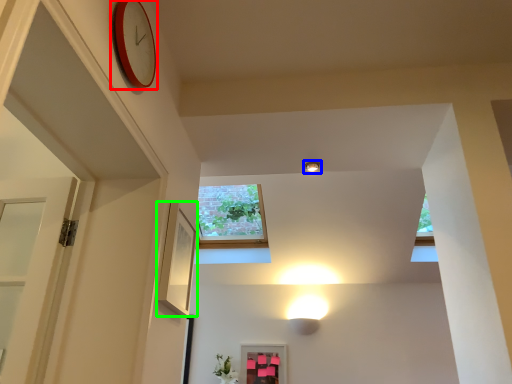
Question: Based on their relative distances, which object is farther from clock (highlighted by a red box)? Choose from light fixture (highlighted by a blue box) and picture frame (highlighted by a green box).

Choices:
 (A) light fixture
 (B) picture frame

Answer: (A)